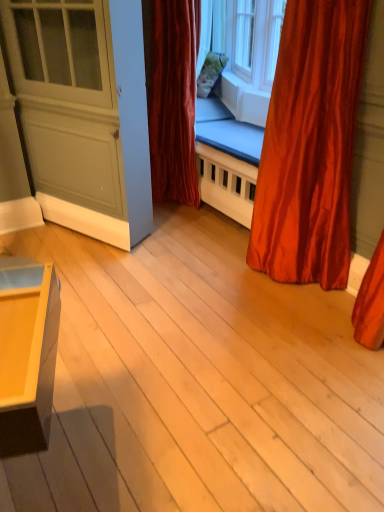
Where is `satin red curtain at right, marked as the 1th curtain in a front-to-back arrangement`? This screenshot has width=384, height=512. satin red curtain at right, marked as the 1th curtain in a front-to-back arrangement is located at coordinates (310, 145).

Which is behind, clear glass window at upper center or satin red curtain at right, the second curtain from the left?

clear glass window at upper center is further from the camera.

Consider the image. Measure the distance between clear glass window at upper center and satin red curtain at right, positioned as the first curtain in right-to-left order.

A distance of 5.71 feet exists between clear glass window at upper center and satin red curtain at right, positioned as the first curtain in right-to-left order.

How different are the orientations of clear glass window at upper center and satin red curtain at right, positioned as the first curtain in right-to-left order, in degrees?

clear glass window at upper center and satin red curtain at right, positioned as the first curtain in right-to-left order, are facing 21.7 degrees away from each other.

From the image's perspective, is clear glass window at upper center above or below satin red curtain at right, positioned as the first curtain in right-to-left order?

From the image's perspective, clear glass window at upper center appears above satin red curtain at right, positioned as the first curtain in right-to-left order.

Is clear glass window at upper center positioned with its back to matte gray screen door at left?

clear glass window at upper center does not have its back to matte gray screen door at left.

Is clear glass window at upper center to the left of matte gray screen door at left from the viewer's perspective?

No.

Which of these two, clear glass window at upper center or matte gray screen door at left, is wider?

With larger width is matte gray screen door at left.

Can you confirm if matte gray screen door at left is shorter than velvet red curtain at center, the 1th curtain when ordered from back to front?

Correct, matte gray screen door at left is not as tall as velvet red curtain at center, the 1th curtain when ordered from back to front.

What are the coordinates of `screen door that is above the velvet red curtain at center, which is the 2th curtain from front to back (from a real-world perspective)` in the screenshot? It's located at (68, 99).

Is matte gray screen door at left looking in the opposite direction of velvet red curtain at center, the 2th curtain positioned from the right?

Absolutely, matte gray screen door at left is directed away from velvet red curtain at center, the 2th curtain positioned from the right.

What's the angular difference between matte gray screen door at left and velvet red curtain at center, which is the 1th curtain in left-to-right order,'s facing directions?

The facing directions of matte gray screen door at left and velvet red curtain at center, which is the 1th curtain in left-to-right order, are 23.8 degrees apart.

Measure the distance between satin red curtain at right, the second curtain viewed from the back, and velvet red curtain at center, the 1th curtain when ordered from back to front.

A distance of 3.82 feet exists between satin red curtain at right, the second curtain viewed from the back, and velvet red curtain at center, the 1th curtain when ordered from back to front.

Based on their positions, is satin red curtain at right, marked as the 1th curtain in a front-to-back arrangement, located to the left or right of velvet red curtain at center, which is the 2th curtain from front to back?

In the image, satin red curtain at right, marked as the 1th curtain in a front-to-back arrangement, appears on the right side of velvet red curtain at center, which is the 2th curtain from front to back.

Where is `curtain behind the satin red curtain at right, positioned as the first curtain in right-to-left order`? Image resolution: width=384 pixels, height=512 pixels. curtain behind the satin red curtain at right, positioned as the first curtain in right-to-left order is located at coordinates (172, 96).

Can you tell me how much satin red curtain at right, marked as the 1th curtain in a front-to-back arrangement, and velvet red curtain at center, the 1th curtain when ordered from back to front, differ in facing direction?

The angular difference between satin red curtain at right, marked as the 1th curtain in a front-to-back arrangement, and velvet red curtain at center, the 1th curtain when ordered from back to front, is 0.00212 degrees.

Measure the distance from satin red curtain at right, the second curtain viewed from the back, to clear glass window at upper center.

They are 1.74 meters apart.

Is point (328, 226) positioned behind point (283, 2)?

No.

Is satin red curtain at right, the second curtain viewed from the back, touching clear glass window at upper center?

No, satin red curtain at right, the second curtain viewed from the back, is not in contact with clear glass window at upper center.

Can you confirm if satin red curtain at right, the second curtain from the left, is smaller than clear glass window at upper center?

Incorrect, satin red curtain at right, the second curtain from the left, is not smaller in size than clear glass window at upper center.

How far apart are satin red curtain at right, marked as the 1th curtain in a front-to-back arrangement, and matte gray screen door at left?

satin red curtain at right, marked as the 1th curtain in a front-to-back arrangement, and matte gray screen door at left are 3.77 feet apart.

Between satin red curtain at right, the second curtain viewed from the back, and matte gray screen door at left, which one has smaller width?

matte gray screen door at left.

From the image's perspective, which is above, satin red curtain at right, the second curtain from the left, or matte gray screen door at left?

matte gray screen door at left is shown above in the image.

Could you tell me if satin red curtain at right, marked as the 1th curtain in a front-to-back arrangement, is turned towards matte gray screen door at left?

No, satin red curtain at right, marked as the 1th curtain in a front-to-back arrangement, is not aimed at matte gray screen door at left.

Would you say clear glass window at upper center is outside velvet red curtain at center, which is the 1th curtain in left-to-right order?

Yes, clear glass window at upper center is located beyond the bounds of velvet red curtain at center, which is the 1th curtain in left-to-right order.

Are clear glass window at upper center and velvet red curtain at center, which is the 1th curtain in left-to-right order, making contact?

clear glass window at upper center is not next to velvet red curtain at center, which is the 1th curtain in left-to-right order, and they're not touching.

From a real-world perspective, is clear glass window at upper center on velvet red curtain at center, which is the 2th curtain from front to back?

Correct, in the physical world, clear glass window at upper center is higher than velvet red curtain at center, which is the 2th curtain from front to back.

Considering the relative positions of clear glass window at upper center and velvet red curtain at center, which is the 2th curtain from front to back, in the image provided, is clear glass window at upper center to the right of velvet red curtain at center, which is the 2th curtain from front to back, from the viewer's perspective?

Indeed, clear glass window at upper center is positioned on the right side of velvet red curtain at center, which is the 2th curtain from front to back.

From the image's perspective, which curtain is the 2nd one below the clear glass window at upper center? Please provide its 2D coordinates.

[(310, 145)]

I want to click on screen door in front of the clear glass window at upper center, so (68, 99).

Estimate the real-world distances between objects in this image. Which object is further from matte gray screen door at left, satin red curtain at right, the second curtain from the left, or clear glass window at upper center?

clear glass window at upper center is positioned further to the anchor matte gray screen door at left.

From the picture: Estimate the real-world distances between objects in this image. Which object is closer to satin red curtain at right, marked as the 1th curtain in a front-to-back arrangement, velvet red curtain at center, the 1th curtain when ordered from back to front, or clear glass window at upper center?

velvet red curtain at center, the 1th curtain when ordered from back to front, lies closer to satin red curtain at right, marked as the 1th curtain in a front-to-back arrangement, than the other object.

From the picture: Estimate the real-world distances between objects in this image. Which object is closer to matte gray screen door at left, clear glass window at upper center or satin red curtain at right, the second curtain from the left?

satin red curtain at right, the second curtain from the left, lies closer to matte gray screen door at left than the other object.

Considering their positions, is velvet red curtain at center, which is the 2th curtain from front to back, positioned further to matte gray screen door at left than satin red curtain at right, the second curtain from the left?

Based on the image, satin red curtain at right, the second curtain from the left, appears to be further to matte gray screen door at left.

When comparing their distances from velvet red curtain at center, which is the 1th curtain in left-to-right order, does clear glass window at upper center or satin red curtain at right, positioned as the first curtain in right-to-left order, seem closer?

clear glass window at upper center.

Considering their positions, is clear glass window at upper center positioned further to satin red curtain at right, the second curtain viewed from the back, than velvet red curtain at center, which is the 1th curtain in left-to-right order?

Based on the image, clear glass window at upper center appears to be further to satin red curtain at right, the second curtain viewed from the back.

Based on their spatial positions, is velvet red curtain at center, which is the 1th curtain in left-to-right order, or clear glass window at upper center further from matte gray screen door at left?

Based on the image, clear glass window at upper center appears to be further to matte gray screen door at left.

Based on their spatial positions, is matte gray screen door at left or satin red curtain at right, marked as the 1th curtain in a front-to-back arrangement, closer to velvet red curtain at center, which is the 2th curtain from front to back?

matte gray screen door at left is positioned closer to the anchor velvet red curtain at center, which is the 2th curtain from front to back.

The width and height of the screenshot is (384, 512). What are the coordinates of `curtain located between matte gray screen door at left and clear glass window at upper center in the depth direction` in the screenshot? It's located at (172, 96).

Locate an element on the screen. This screenshot has height=512, width=384. curtain between satin red curtain at right, the second curtain from the left, and clear glass window at upper center in the front-back direction is located at coordinates (172, 96).

The height and width of the screenshot is (512, 384). I want to click on curtain between matte gray screen door at left and satin red curtain at right, marked as the 1th curtain in a front-to-back arrangement, so click(x=172, y=96).

This screenshot has width=384, height=512. Identify the location of screen door positioned between satin red curtain at right, the second curtain viewed from the back, and clear glass window at upper center from near to far. (68, 99).